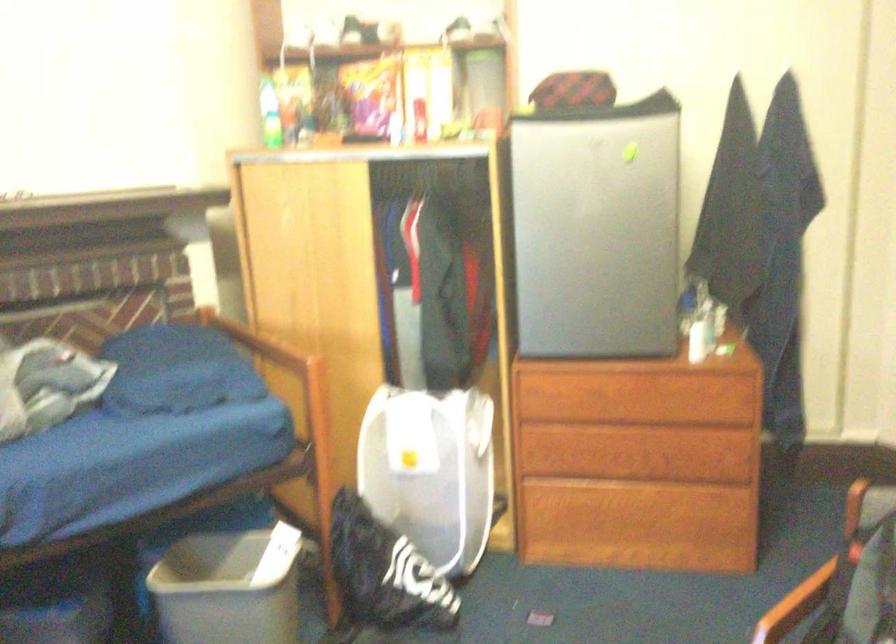
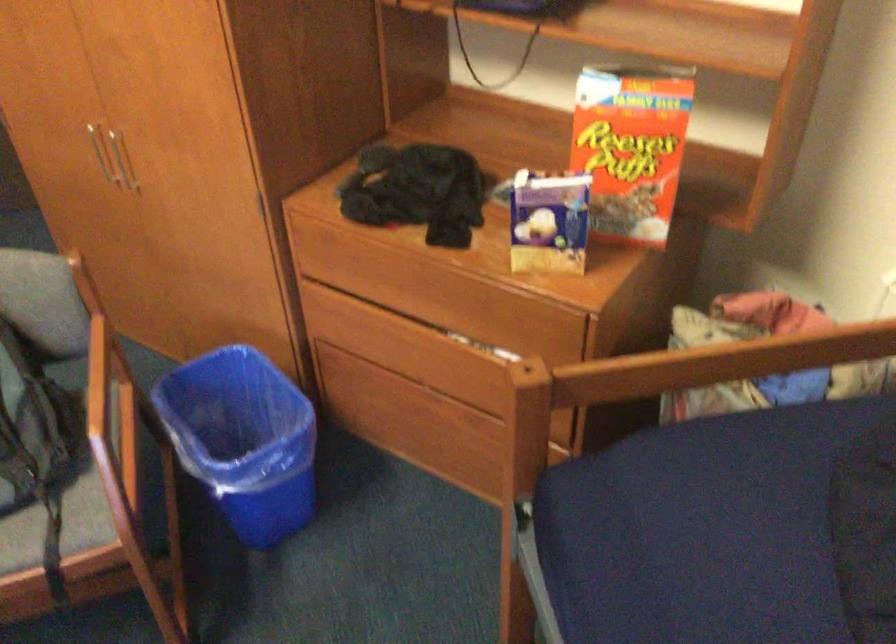
Based on the continuous images, in which direction is the camera rotating?

The camera's rotation is toward right-down.